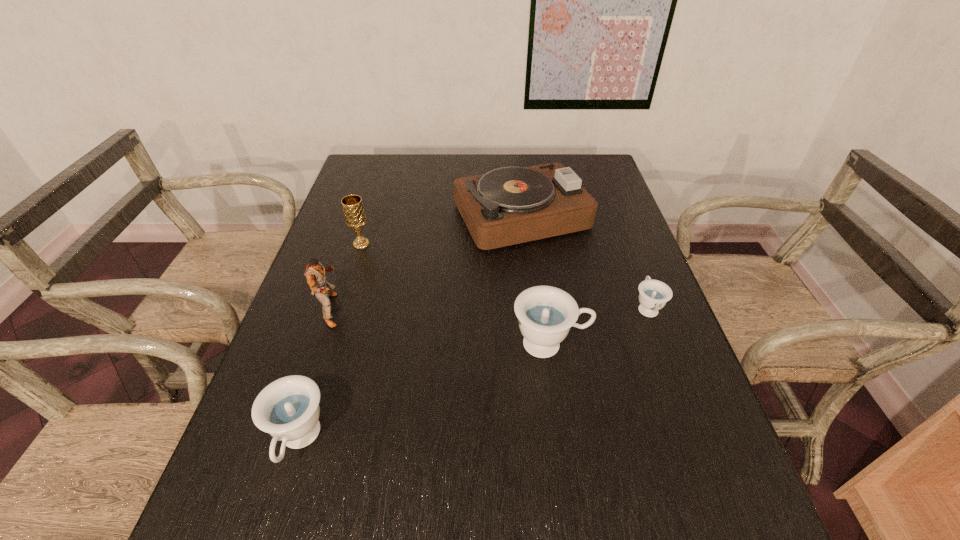
The width and height of the screenshot is (960, 540). Identify the location of vacant space located 0.390m on the side of the rightmost teacup with the handle. (609, 206).

I want to click on vacant space situated on the side of the rightmost teacup with the handle, so click(x=618, y=232).

You are a GUI agent. You are given a task and a screenshot of the screen. Output one action in this format:
    pyautogui.click(x=<x>, y=<y>)
    Task: Click on the free space located on the left of the record player
    
    Given the screenshot: What is the action you would take?
    pyautogui.click(x=393, y=215)

Where is `vacant position located 0.300m on the back of the chalice`? Image resolution: width=960 pixels, height=540 pixels. vacant position located 0.300m on the back of the chalice is located at coordinates (380, 183).

The height and width of the screenshot is (540, 960). In order to click on free space located 0.050m on the front-facing side of the puncher in this screenshot , I will do `click(365, 310)`.

I want to click on object that is at the far edge, so click(506, 206).

Where is `object situated at the near edge`? The image size is (960, 540). object situated at the near edge is located at coordinates (288, 409).

Identify the location of teacup positioned at the left edge. (288, 409).

This screenshot has height=540, width=960. Find the location of `chalice at the left edge`. chalice at the left edge is located at coordinates (355, 218).

Find the location of a particular element. The width and height of the screenshot is (960, 540). puncher positioned at the left edge is located at coordinates (315, 272).